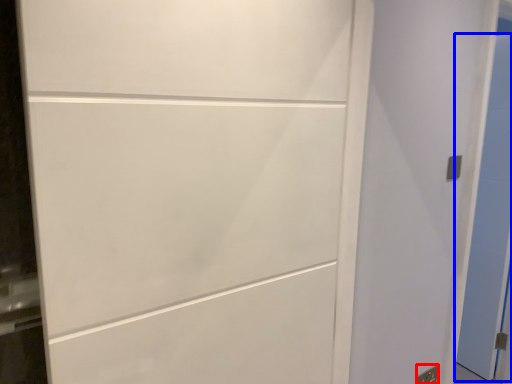
Question: Among these objects, which one is farthest to the camera, electric outlet (highlighted by a red box) or door (highlighted by a blue box)?

Choices:
 (A) electric outlet
 (B) door

Answer: (B)